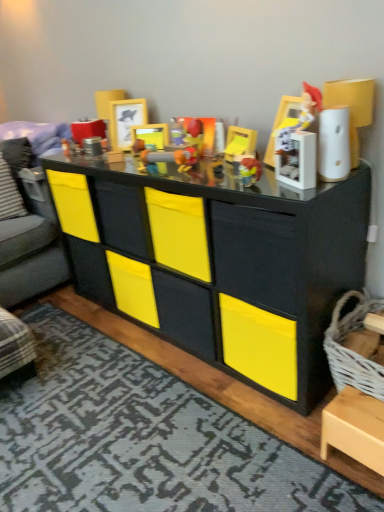
Question: In which direction should I rotate to look at plastic toy gun at center, arranged as the 1th toy when viewed from the left?

Choices:
 (A) left
 (B) right

Answer: (A)

Question: From the image's perspective, is translucent plastic toy at center, arranged as the 2th toy when viewed from the right, under wooden picture frame at upper center, the first picture frame when ordered from back to front?

Choices:
 (A) yes
 (B) no

Answer: (A)

Question: Does translucent plastic toy at center, arranged as the 2th toy when viewed from the right, have a greater width compared to wooden picture frame at upper center, the first picture frame when ordered from back to front?

Choices:
 (A) no
 (B) yes

Answer: (A)

Question: Is translucent plastic toy at center, arranged as the 2th toy when viewed from the right, positioned with its back to wooden picture frame at upper center, acting as the 2th picture frame starting from the front?

Choices:
 (A) yes
 (B) no

Answer: (B)

Question: Is translucent plastic toy at center, arranged as the 2th toy when viewed from the right, completely or partially outside of wooden picture frame at upper center, the first picture frame when ordered from back to front?

Choices:
 (A) no
 (B) yes

Answer: (B)

Question: From a real-world perspective, is translucent plastic toy at center, arranged as the 2th toy when viewed from the right, physically above wooden picture frame at upper center, acting as the 2th picture frame starting from the front?

Choices:
 (A) yes
 (B) no

Answer: (B)

Question: Does translucent plastic toy at center, acting as the 4th toy starting from the left, have a lesser width compared to wooden picture frame at upper center, the first picture frame when ordered from back to front?

Choices:
 (A) yes
 (B) no

Answer: (A)

Question: Is plastic toy gun at center, arranged as the 1th toy when viewed from the left, surrounding translucent plastic toy at center, arranged as the 2th toy when viewed from the right?

Choices:
 (A) yes
 (B) no

Answer: (B)

Question: Is the depth of plastic toy gun at center, which is the fifth toy from right to left, less than that of translucent plastic toy at center, acting as the 4th toy starting from the left?

Choices:
 (A) no
 (B) yes

Answer: (A)

Question: Can you confirm if plastic toy gun at center, which is the fifth toy from right to left, is thinner than translucent plastic toy at center, arranged as the 2th toy when viewed from the right?

Choices:
 (A) yes
 (B) no

Answer: (B)

Question: From a real-world perspective, is plastic toy gun at center, which is the fifth toy from right to left, located beneath translucent plastic toy at center, acting as the 4th toy starting from the left?

Choices:
 (A) no
 (B) yes

Answer: (A)

Question: Can you confirm if plastic toy gun at center, arranged as the 1th toy when viewed from the left, is positioned to the left of translucent plastic toy at center, arranged as the 2th toy when viewed from the right?

Choices:
 (A) no
 (B) yes

Answer: (B)

Question: Is plastic toy gun at center, arranged as the 1th toy when viewed from the left, to the right of translucent plastic toy at center, arranged as the 2th toy when viewed from the right, from the viewer's perspective?

Choices:
 (A) yes
 (B) no

Answer: (B)

Question: Does matte plastic toy at center, which ranks as the third toy in left-to-right order, touch wooden picture frame at upper center, the first picture frame when ordered from back to front?

Choices:
 (A) no
 (B) yes

Answer: (A)